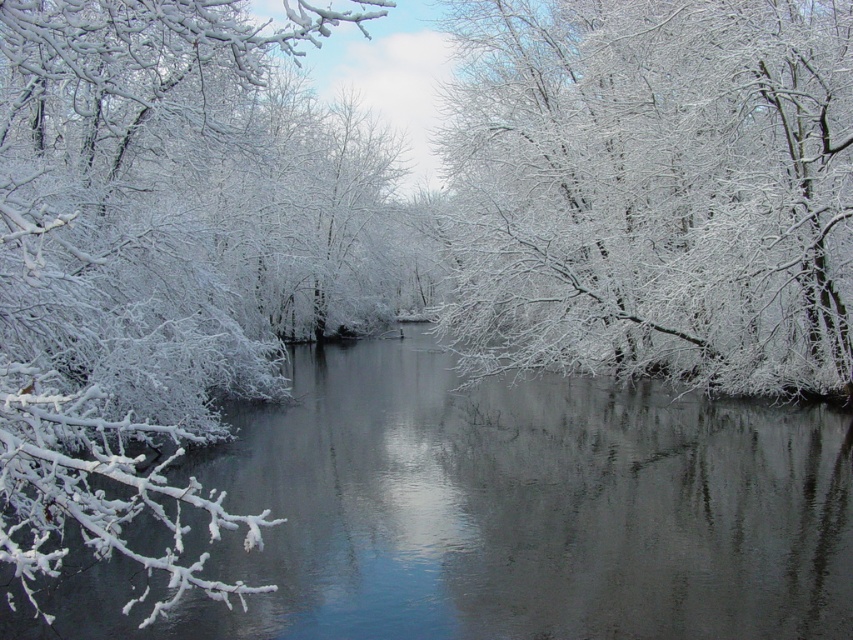
You are an artist sketching the winter scene. You notice two sets of white frosty branches in your view. Which set of branches, the white frosty branches at upper center or the white frosty branches at left, is positioned to the right side of the other?

The white frosty branches at upper center are positioned to the right of the white frosty branches at left.

You are an artist sketching the winter scene and want to ensure the proportions of the white frosty branches at upper center and the white frosty branches at left are accurate. Which set of branches should you draw smaller to maintain the scene?

The white frosty branches at upper center should be drawn smaller because they occupy less space than the white frosty branches at left.

You are standing in the winter scene and want to take a photo of both the white frosty branches at upper center and the white frosty branches at left. Which set of branches will appear closer to you in the photo?

The white frosty branches at upper center will appear closer to you in the photo because they are positioned closer to the viewer compared to the white frosty branches at left.